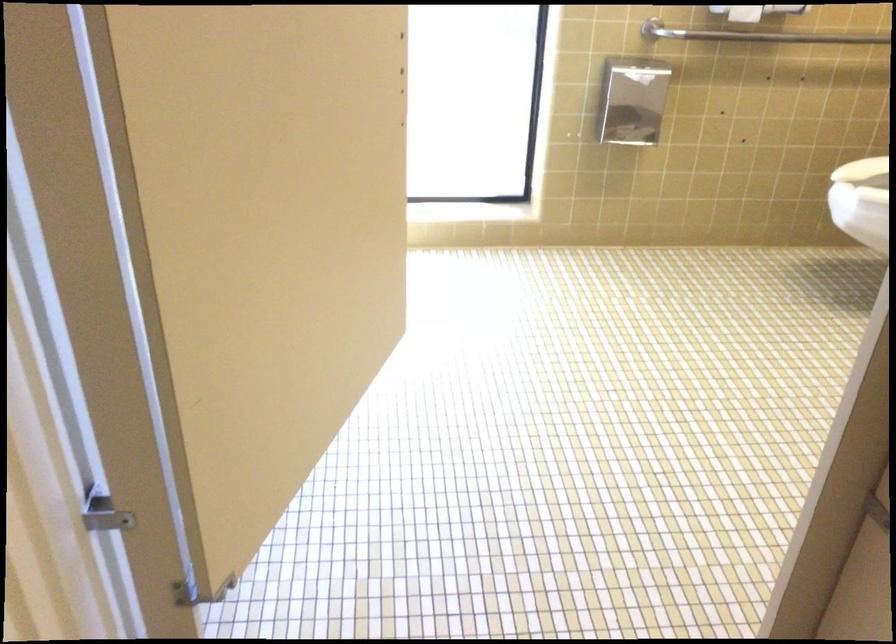
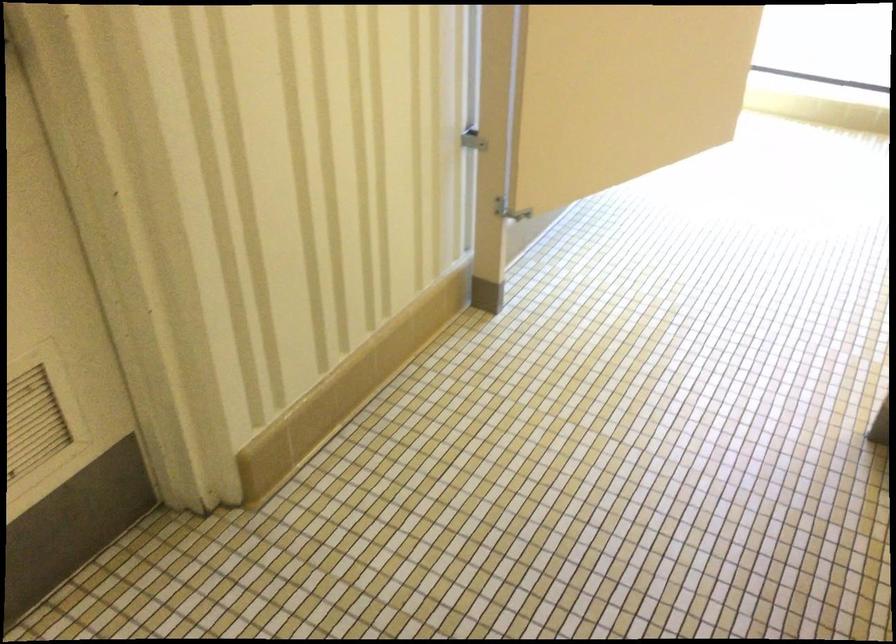
Question: The camera is either moving clockwise (left) or counter-clockwise (right) around the object. The first image is from the beginning of the video and the second image is from the end. Is the camera moving left or right when shooting the video?

Choices:
 (A) Left
 (B) Right

Answer: (B)